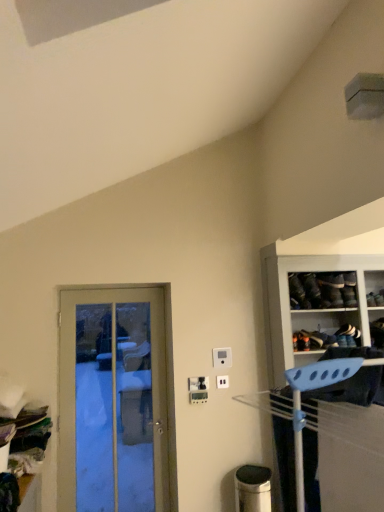
Find the location of a particular element. Image resolution: width=384 pixels, height=512 pixels. white leather shoe at upper right, which is the first shoe from bottom to top is located at coordinates (348, 331).

Where is `white plastic electric outlet at center, the 3th electric outlet viewed from the top`? Image resolution: width=384 pixels, height=512 pixels. white plastic electric outlet at center, the 3th electric outlet viewed from the top is located at coordinates (222, 382).

You are a GUI agent. You are given a task and a screenshot of the screen. Output one action in this format:
    pyautogui.click(x=<x>, y=<y>)
    Task: Click on the blue plastic hanger at right
    This screenshot has height=512, width=384.
    Given the screenshot: What is the action you would take?
    pyautogui.click(x=313, y=330)

At what (x,y) coordinates should I click in order to perform the action: click on white leather shoe at upper right, acting as the 1th shoe starting from the right. Please return your answer as a coordinate pair (x, y). This screenshot has height=512, width=384. Looking at the image, I should click on (348, 331).

How many degrees apart are the facing directions of white plastic electric outlet at center, the 1th electric outlet ordered from the bottom, and white leather shoe at upper right, acting as the 1th shoe starting from the right?

They differ by 6.13 degrees in their facing directions.

Between white plastic electric outlet at center, the 3th electric outlet viewed from the top, and white leather shoe at upper right, acting as the 1th shoe starting from the right, which one has smaller size?

Smaller between the two is white plastic electric outlet at center, the 3th electric outlet viewed from the top.

From the image's perspective, starting from the white leather shoe at upper right, which is the 2th shoe in top-to-bottom order, which electric outlet is the 3rd one below? Please provide its 2D coordinates.

[(222, 382)]

Is white plastic electric outlet at center, the 1th electric outlet ordered from the bottom, not inside white leather shoe at upper right, acting as the second shoe starting from the left?

white plastic electric outlet at center, the 1th electric outlet ordered from the bottom, lies outside white leather shoe at upper right, acting as the second shoe starting from the left,'s area.

From the image's perspective, relative to white plastic electric outlet at center, the 2th electric outlet positioned from the bottom, is white plastic electric outlet at center, the first electric outlet from the top, above or below?

Clearly, from the image's perspective, white plastic electric outlet at center, the first electric outlet from the top, is above white plastic electric outlet at center, the 2th electric outlet positioned from the bottom.

Could you tell me if white plastic electric outlet at center, the first electric outlet from the top, is facing white plastic electric outlet at center, the 2th electric outlet viewed from the top?

No, white plastic electric outlet at center, the first electric outlet from the top, is not turned towards white plastic electric outlet at center, the 2th electric outlet viewed from the top.

From a real-world perspective, does white plastic electric outlet at center, which is the third electric outlet in bottom-to-top order, sit lower than white plastic electric outlet at center, the 2th electric outlet viewed from the top?

Actually, white plastic electric outlet at center, which is the third electric outlet in bottom-to-top order, is physically above white plastic electric outlet at center, the 2th electric outlet viewed from the top, in the real world.

Is white plastic electric outlet at center, the first electric outlet from the top, to the right of white plastic electric outlet at center, the 2th electric outlet positioned from the bottom, from the viewer's perspective?

Correct, you'll find white plastic electric outlet at center, the first electric outlet from the top, to the right of white plastic electric outlet at center, the 2th electric outlet positioned from the bottom.

Is point (150, 332) more distant than point (302, 300)?

Yes, it is behind point (302, 300).

Which is more to the right, wooden door at left or leather black shoe at upper right, placed as the 2th shoe when sorted from right to left?

leather black shoe at upper right, placed as the 2th shoe when sorted from right to left.

Which of these two, wooden door at left or leather black shoe at upper right, which is counted as the second shoe, starting from the bottom, stands taller?

wooden door at left is taller.

Measure the distance from wooden door at left to leather black shoe at upper right, positioned as the first shoe in top-to-bottom order.

wooden door at left is 1.80 meters away from leather black shoe at upper right, positioned as the first shoe in top-to-bottom order.

Considering the sizes of objects white leather shoe at upper right, acting as the 1th shoe starting from the right, and white plastic electric outlet at center, which is the third electric outlet in bottom-to-top order, in the image provided, who is smaller, white leather shoe at upper right, acting as the 1th shoe starting from the right, or white plastic electric outlet at center, which is the third electric outlet in bottom-to-top order,?

white plastic electric outlet at center, which is the third electric outlet in bottom-to-top order, is smaller.

Is white leather shoe at upper right, which is the 2th shoe in top-to-bottom order, positioned far away from white plastic electric outlet at center, the first electric outlet from the top?

No, there isn't a large distance between white leather shoe at upper right, which is the 2th shoe in top-to-bottom order, and white plastic electric outlet at center, the first electric outlet from the top.

Is white leather shoe at upper right, acting as the second shoe starting from the left, closer to the viewer compared to white plastic electric outlet at center, which is the third electric outlet in bottom-to-top order?

Yes, white leather shoe at upper right, acting as the second shoe starting from the left, is closer to the viewer.

Looking at this image, can you confirm if wooden door at left is bigger than white plastic electric outlet at center, which is the third electric outlet in bottom-to-top order?

Correct, wooden door at left is larger in size than white plastic electric outlet at center, which is the third electric outlet in bottom-to-top order.

Is point (163, 357) closer to camera compared to point (222, 360)?

No, (163, 357) is behind (222, 360).

Looking at this image, can you confirm if wooden door at left is thinner than white plastic electric outlet at center, the first electric outlet from the top?

In fact, wooden door at left might be wider than white plastic electric outlet at center, the first electric outlet from the top.

Measure the distance between wooden door at left and white plastic electric outlet at center, the first electric outlet from the top.

wooden door at left is 1.16 meters away from white plastic electric outlet at center, the first electric outlet from the top.

Based on their sizes in the image, would you say leather black shoe at upper right, placed as the 2th shoe when sorted from right to left, is bigger or smaller than wooden door at left?

Clearly, leather black shoe at upper right, placed as the 2th shoe when sorted from right to left, is smaller in size than wooden door at left.

Considering the positions of objects leather black shoe at upper right, which appears as the first shoe when viewed from the left, and wooden door at left in the image provided, who is more to the left, leather black shoe at upper right, which appears as the first shoe when viewed from the left, or wooden door at left?

wooden door at left.

Is leather black shoe at upper right, placed as the 2th shoe when sorted from right to left, not inside wooden door at left?

leather black shoe at upper right, placed as the 2th shoe when sorted from right to left, lies outside wooden door at left's area.

Does leather black shoe at upper right, which is counted as the second shoe, starting from the bottom, come behind white plastic electric outlet at center, the 3th electric outlet viewed from the top?

No.

Consider the image. Do you think leather black shoe at upper right, which appears as the first shoe when viewed from the left, is within white plastic electric outlet at center, the 1th electric outlet ordered from the bottom, or outside of it?

leather black shoe at upper right, which appears as the first shoe when viewed from the left, is spatially situated outside white plastic electric outlet at center, the 1th electric outlet ordered from the bottom.

You are a GUI agent. You are given a task and a screenshot of the screen. Output one action in this format:
    pyautogui.click(x=<x>, y=<y>)
    Task: Click on the electric outlet that is the 3rd one when counting downward from the leather black shoe at upper right, positioned as the first shoe in top-to-bottom order (from the image's perspective)
    This screenshot has width=384, height=512.
    Given the screenshot: What is the action you would take?
    pyautogui.click(x=222, y=382)

From the picture: Considering the sizes of objects leather black shoe at upper right, positioned as the first shoe in top-to-bottom order, and white plastic electric outlet at center, the 1th electric outlet ordered from the bottom, in the image provided, who is smaller, leather black shoe at upper right, positioned as the first shoe in top-to-bottom order, or white plastic electric outlet at center, the 1th electric outlet ordered from the bottom,?

Smaller between the two is white plastic electric outlet at center, the 1th electric outlet ordered from the bottom.

Identify the location of shoe that is the 1st object located in front of the white plastic electric outlet at center, the 3th electric outlet viewed from the top. Image resolution: width=384 pixels, height=512 pixels. (348, 331).

You are a GUI agent. You are given a task and a screenshot of the screen. Output one action in this format:
    pyautogui.click(x=<x>, y=<y>)
    Task: Click on the electric outlet above the white plastic electric outlet at center, the 2th electric outlet viewed from the top (from the image's perspective)
    The image size is (384, 512).
    Given the screenshot: What is the action you would take?
    pyautogui.click(x=222, y=357)

Which object lies further to the anchor point white plastic electric outlet at center, the 2th electric outlet positioned from the bottom, white leather shoe at upper right, acting as the 1th shoe starting from the right, or wooden door at left?

white leather shoe at upper right, acting as the 1th shoe starting from the right, is positioned further to the anchor white plastic electric outlet at center, the 2th electric outlet positioned from the bottom.

Considering their positions, is blue plastic hanger at right positioned closer to white plastic electric outlet at center, the 3th electric outlet viewed from the top, than white plastic electric outlet at center, the 2th electric outlet viewed from the top?

white plastic electric outlet at center, the 2th electric outlet viewed from the top, lies closer to white plastic electric outlet at center, the 3th electric outlet viewed from the top, than the other object.

Looking at this image, which object lies further to the anchor point blue plastic hanger at right, wooden door at left or leather black shoe at upper right, which appears as the first shoe when viewed from the left?

wooden door at left is positioned further to the anchor blue plastic hanger at right.

When comparing their distances from leather black shoe at upper right, which is counted as the second shoe, starting from the bottom, does white plastic electric outlet at center, the 2th electric outlet positioned from the bottom, or blue plastic hanger at right seem closer?

blue plastic hanger at right.

Considering their positions, is blue plastic hanger at right positioned closer to leather black shoe at upper right, which appears as the first shoe when viewed from the left, than white plastic electric outlet at center, which is the third electric outlet in bottom-to-top order?

blue plastic hanger at right lies closer to leather black shoe at upper right, which appears as the first shoe when viewed from the left, than the other object.

Which object lies nearer to the anchor point white plastic electric outlet at center, which is the third electric outlet in bottom-to-top order, wooden door at left or white plastic electric outlet at center, the 1th electric outlet ordered from the bottom?

Among the two, white plastic electric outlet at center, the 1th electric outlet ordered from the bottom, is located nearer to white plastic electric outlet at center, which is the third electric outlet in bottom-to-top order.

Estimate the real-world distances between objects in this image. Which object is closer to white plastic electric outlet at center, the 1th electric outlet ordered from the bottom, white plastic electric outlet at center, which is the third electric outlet in bottom-to-top order, or leather black shoe at upper right, placed as the 2th shoe when sorted from right to left?

Among the two, white plastic electric outlet at center, which is the third electric outlet in bottom-to-top order, is located nearer to white plastic electric outlet at center, the 1th electric outlet ordered from the bottom.

Consider the image. Considering their positions, is blue plastic hanger at right positioned closer to wooden door at left than leather black shoe at upper right, placed as the 2th shoe when sorted from right to left?

The object closer to wooden door at left is blue plastic hanger at right.

This screenshot has height=512, width=384. I want to click on electric outlet between blue plastic hanger at right and white plastic electric outlet at center, the 1th electric outlet ordered from the bottom, from front to back, so click(198, 384).

Where is `electric outlet between white plastic electric outlet at center, the first electric outlet from the top, and white leather shoe at upper right, which is the 2th shoe in top-to-bottom order, in the horizontal direction`? Image resolution: width=384 pixels, height=512 pixels. electric outlet between white plastic electric outlet at center, the first electric outlet from the top, and white leather shoe at upper right, which is the 2th shoe in top-to-bottom order, in the horizontal direction is located at coordinates (222, 382).

Locate an element on the screen. The width and height of the screenshot is (384, 512). door positioned between blue plastic hanger at right and white plastic electric outlet at center, which is the third electric outlet in bottom-to-top order, from near to far is located at coordinates (113, 401).

Locate an element on the screen. The height and width of the screenshot is (512, 384). door between blue plastic hanger at right and white plastic electric outlet at center, the 1th electric outlet ordered from the bottom, along the z-axis is located at coordinates (113, 401).